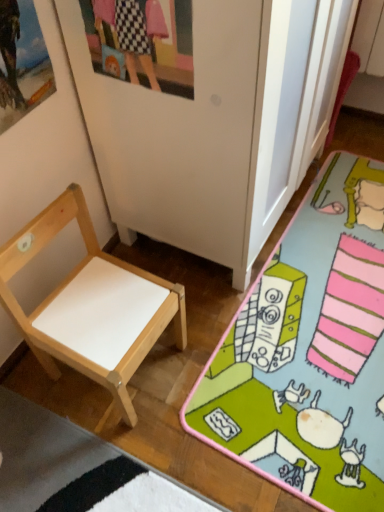
Question: Based on their positions, is wooden picture frame at upper left, which ranks as the 1th picture frame in left-to-right order, located to the left or right of matte plastic picture frame at upper center, the 1th picture frame from the right?

Choices:
 (A) right
 (B) left

Answer: (B)

Question: From the image's perspective, is wooden picture frame at upper left, which ranks as the 1th picture frame in left-to-right order, positioned above or below matte plastic picture frame at upper center, which is the 2th picture frame in left-to-right order?

Choices:
 (A) below
 (B) above

Answer: (A)

Question: Which is farther from the white matte desk at lower left?

Choices:
 (A) matte plastic picture frame at upper center, which is the 2th picture frame in left-to-right order
 (B) wooden picture frame at upper left, the 2th picture frame from the right
 (C) natural wood chair at left

Answer: (B)

Question: Based on their relative distances, which object is farther from the wooden picture frame at upper left, which ranks as the 1th picture frame in left-to-right order?

Choices:
 (A) natural wood chair at left
 (B) matte plastic picture frame at upper center, the 1th picture frame from the right
 (C) white matte desk at lower left

Answer: (C)